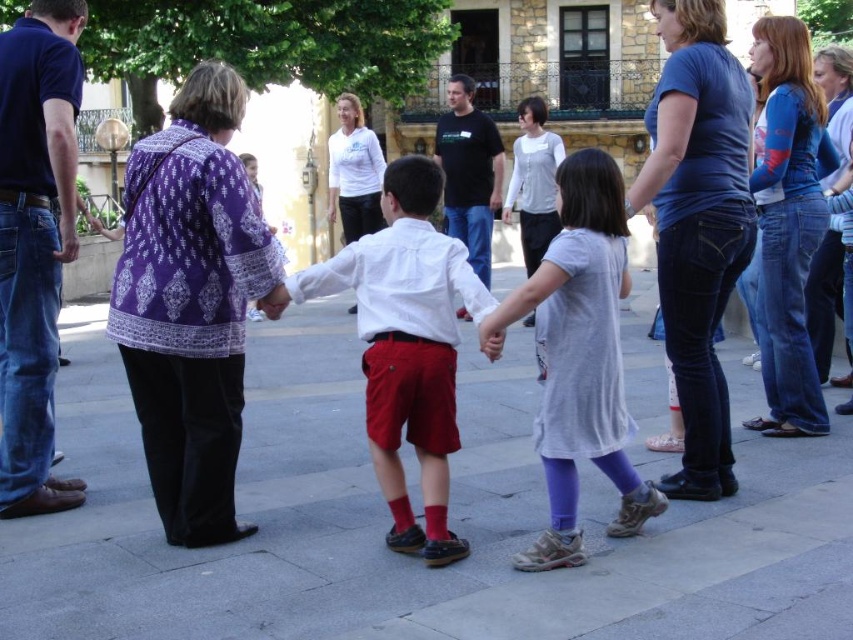
Question: Among these objects, which one is nearest to the camera?

Choices:
 (A) red cotton sock at lower center
 (B) blue denim jeans at center
 (C) matte white shirt at center
 (D) red matte sock at lower center

Answer: (C)

Question: Is blue denim jeans at center smaller than red matte sock at lower center?

Choices:
 (A) yes
 (B) no

Answer: (B)

Question: Does gray concrete pavement at center have a larger size compared to red cotton sock at lower center?

Choices:
 (A) yes
 (B) no

Answer: (A)

Question: Estimate the real-world distances between objects in this image. Which object is closer to the matte white shirt at center?

Choices:
 (A) black cotton shirt at center
 (B) purple printed blouse at left

Answer: (B)

Question: From the image, what is the correct spatial relationship of gray concrete pavement at center in relation to black cotton shirt at center?

Choices:
 (A) left
 (B) right

Answer: (A)

Question: Based on their relative distances, which object is farther from the red matte sock at lower center?

Choices:
 (A) denim jeans at left
 (B) light gray cotton dress at center
 (C) matte white shirt at center

Answer: (A)